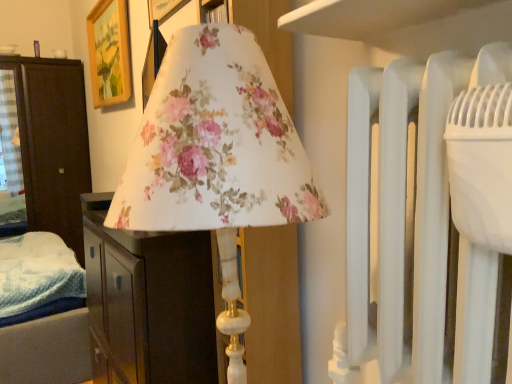
Question: From the image's perspective, is dark wood wardrobe at left, the first furniture positioned from the left, located above wooden picture frame at upper left?

Choices:
 (A) yes
 (B) no

Answer: (B)

Question: Is dark wood wardrobe at left, placed as the first furniture when sorted from back to front, to the left of wooden picture frame at upper left from the viewer's perspective?

Choices:
 (A) no
 (B) yes

Answer: (B)

Question: Does dark wood wardrobe at left, which is counted as the 2th furniture, starting from the right, have a greater height compared to wooden picture frame at upper left?

Choices:
 (A) yes
 (B) no

Answer: (A)

Question: Is there a large distance between dark wood wardrobe at left, placed as the first furniture when sorted from back to front, and wooden picture frame at upper left?

Choices:
 (A) yes
 (B) no

Answer: (B)

Question: Is dark wood wardrobe at left, which is counted as the 2th furniture, starting from the right, positioned before wooden picture frame at upper left?

Choices:
 (A) no
 (B) yes

Answer: (A)

Question: In terms of width, does floral fabric lampshade at center, the 1th furniture in the front-to-back sequence, look wider or thinner when compared to wooden picture frame at upper left?

Choices:
 (A) thin
 (B) wide

Answer: (B)

Question: Considering their positions, is floral fabric lampshade at center, the 1th furniture in the front-to-back sequence, located in front of or behind wooden picture frame at upper left?

Choices:
 (A) behind
 (B) front

Answer: (B)

Question: From the image's perspective, is floral fabric lampshade at center, placed as the second furniture when sorted from left to right, located above or below wooden picture frame at upper left?

Choices:
 (A) above
 (B) below

Answer: (B)

Question: From a real-world perspective, relative to wooden picture frame at upper left, is floral fabric lampshade at center, the 1th furniture in the front-to-back sequence, vertically above or below?

Choices:
 (A) below
 (B) above

Answer: (A)

Question: Is wooden picture frame at upper left taller or shorter than floral fabric lampshade at center, positioned as the 1th furniture in right-to-left order?

Choices:
 (A) tall
 (B) short

Answer: (B)

Question: Would you say wooden picture frame at upper left is to the left or to the right of floral fabric lampshade at center, which is the second furniture from back to front, in the picture?

Choices:
 (A) right
 (B) left

Answer: (B)

Question: From a real-world perspective, is wooden picture frame at upper left positioned above or below floral fabric lampshade at center, which is the second furniture from back to front?

Choices:
 (A) above
 (B) below

Answer: (A)

Question: From the image's perspective, is wooden picture frame at upper left located above or below floral fabric lampshade at center, the 1th furniture in the front-to-back sequence?

Choices:
 (A) above
 (B) below

Answer: (A)

Question: Is dark wood wardrobe at left, the first furniture positioned from the left, spatially inside floral fabric lampshade at center, which is the second furniture from back to front, or outside of it?

Choices:
 (A) inside
 (B) outside

Answer: (B)

Question: Looking at the image, does dark wood wardrobe at left, placed as the first furniture when sorted from back to front, seem bigger or smaller compared to floral fabric lampshade at center, the 1th furniture in the front-to-back sequence?

Choices:
 (A) small
 (B) big

Answer: (A)